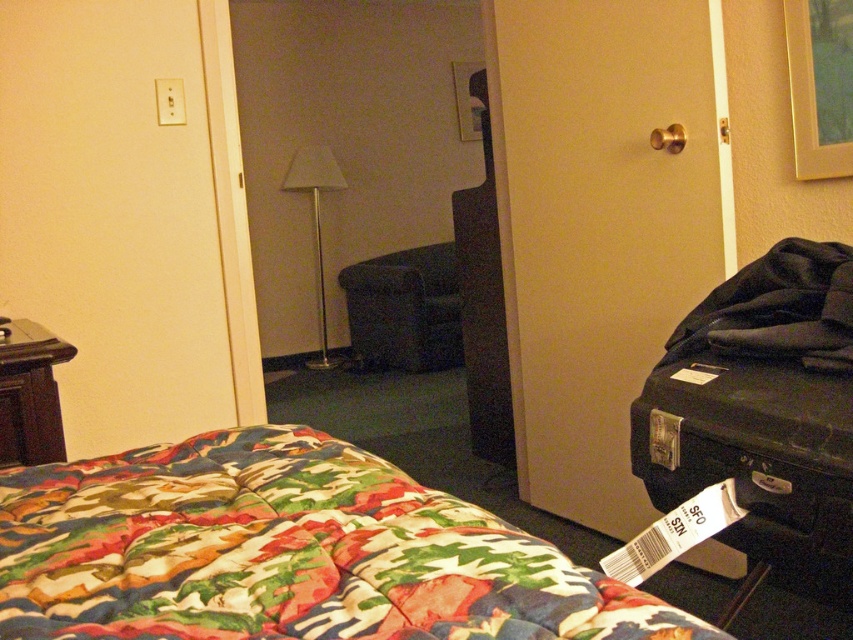
Identify the location of gold wooden picture frame at upper right. The width and height of the screenshot is (853, 640). (819, 86).

The image size is (853, 640). What do you see at coordinates (819, 86) in the screenshot?
I see `gold wooden picture frame at upper right` at bounding box center [819, 86].

Which is in front, point (791, 19) or point (460, 65)?

Point (791, 19)

Locate an element on the screen. The width and height of the screenshot is (853, 640). gold wooden picture frame at upper right is located at coordinates (819, 86).

Which is behind, point (817, 589) or point (467, 104)?

Point (467, 104)

Does black hard suitcase at right appear on the left side of wooden picture frame at upper center?

Incorrect, black hard suitcase at right is not on the left side of wooden picture frame at upper center.

Who is more distant from viewer, (676, 451) or (476, 138)?

Positioned behind is point (476, 138).

This screenshot has width=853, height=640. I want to click on black hard suitcase at right, so click(x=756, y=458).

Which is below, brown wood dresser at left or wooden picture frame at upper center?

brown wood dresser at left is below.

Is point (49, 442) in front of point (463, 124)?

Yes, it is.

This screenshot has width=853, height=640. What do you see at coordinates (30, 396) in the screenshot?
I see `brown wood dresser at left` at bounding box center [30, 396].

Where is `brown wood dresser at left`? This screenshot has width=853, height=640. brown wood dresser at left is located at coordinates (30, 396).